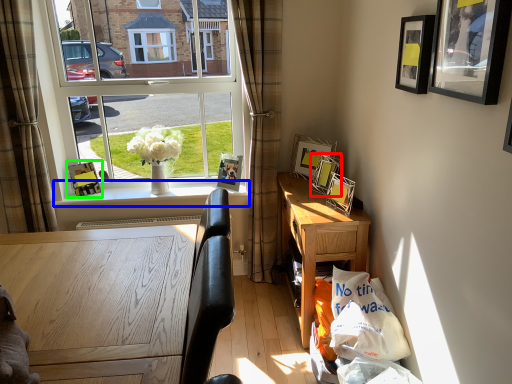
Question: Estimate the real-world distances between objects in this image. Which object is closer to picture frame (highlighted by a red box), window sill (highlighted by a blue box) or picture frame (highlighted by a green box)?

Choices:
 (A) window sill
 (B) picture frame

Answer: (A)